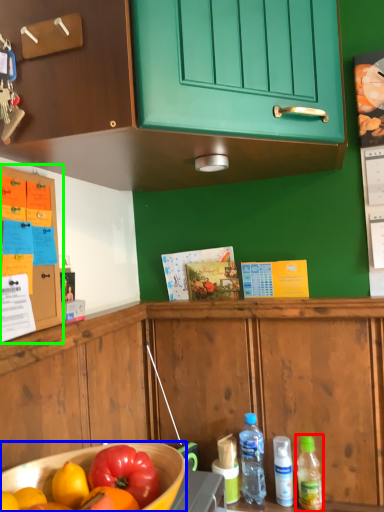
Question: Estimate the real-world distances between objects in this image. Which object is farther from bottle (highlighted by a red box), bowl (highlighted by a blue box) or cabinetry (highlighted by a green box)?

Choices:
 (A) bowl
 (B) cabinetry

Answer: (B)